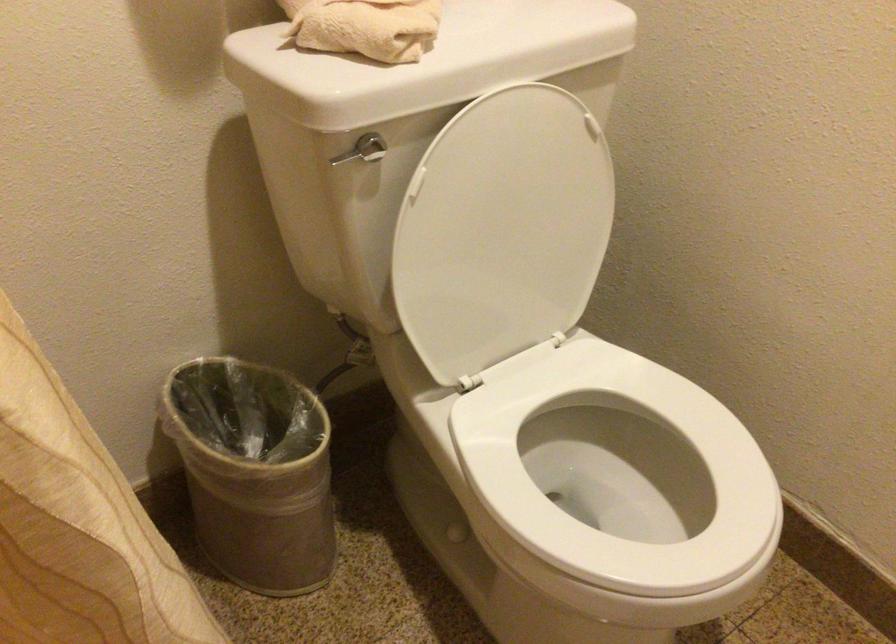
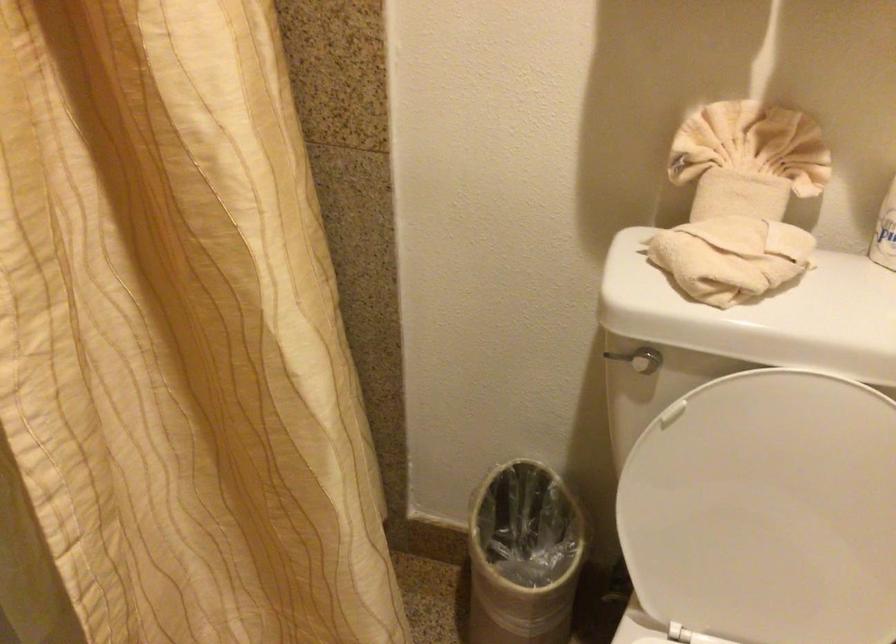
Where in the second image is the point corresponding to (x=339, y=158) from the first image?

(616, 357)